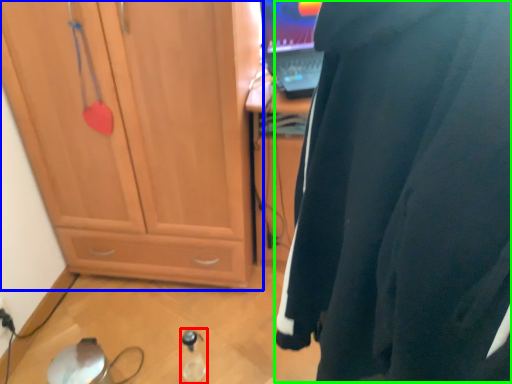
Question: Based on their relative distances, which object is farther from bottle (highlighted by a red box)? Choose from cabinetry (highlighted by a blue box) and wetsuit (highlighted by a green box).

Choices:
 (A) cabinetry
 (B) wetsuit

Answer: (B)